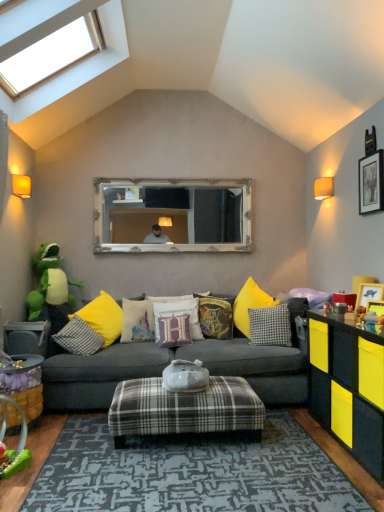
Question: Is velvet purple pillow at center, positioned as the fourth pillow in left-to-right order, taller or shorter than plaid fabric ottoman at center?

Choices:
 (A) short
 (B) tall

Answer: (A)

Question: From a real-world perspective, is velvet purple pillow at center, marked as the fourth pillow in a right-to-left arrangement, above or below plaid fabric ottoman at center?

Choices:
 (A) below
 (B) above

Answer: (B)

Question: Which is nearer to the checkered fabric pillow at center, which is the first pillow from right to left?

Choices:
 (A) velvet harry potter cushion at center, which is the 3th pillow in right-to-left order
 (B) yellow fabric pillow at center, the sixth pillow when ordered from right to left
 (C) yellow matte picture frame at right, the third picture frame in the top-to-bottom sequence
 (D) wooden framed picture at upper right, the 1th picture frame from the back
 (E) velvet harry potter-themed pillow at center, acting as the sixth pillow starting from the left

Answer: (E)

Question: Estimate the real-world distances between objects in this image. Which object is farther from the wooden picture frame at right, which appears as the 2th picture frame when viewed from the front?

Choices:
 (A) velvet purple pillow at center, marked as the fourth pillow in a right-to-left arrangement
 (B) transparent glass skylight at upper left
 (C) plaid fabric ottoman at center
 (D) yellow matte cabinet at right
 (E) checkered fabric pillow at center, the first pillow in the left-to-right sequence

Answer: (B)